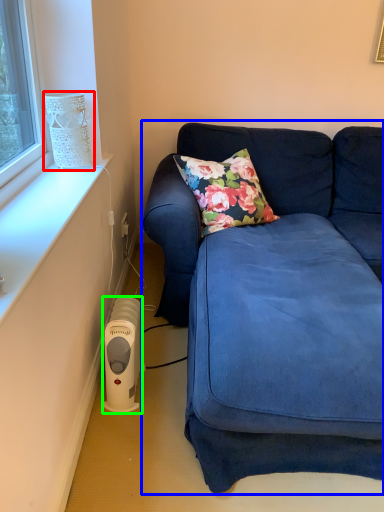
Question: Which object is the closest to the lamp (highlighted by a red box)? Choose among these: studio couch (highlighted by a blue box) or appliance (highlighted by a green box).

Choices:
 (A) studio couch
 (B) appliance

Answer: (B)